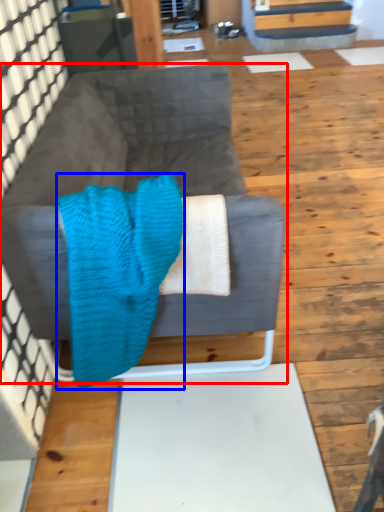
Question: Among these objects, which one is farthest to the camera, studio couch (highlighted by a red box) or blanket (highlighted by a blue box)?

Choices:
 (A) studio couch
 (B) blanket

Answer: (A)